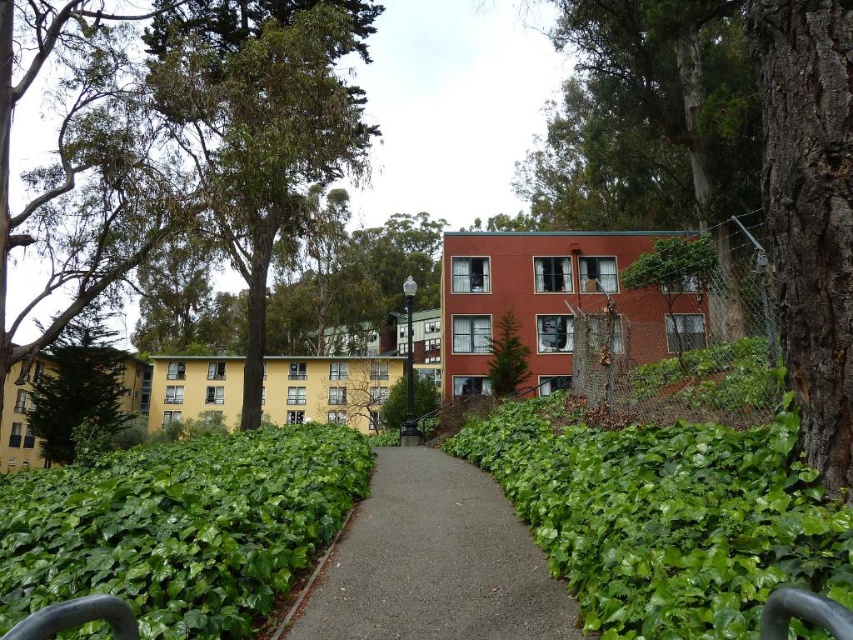
Based on the photo, which is below, green leafy hedge at center or green leafy tree at upper left?

Positioned lower is green leafy hedge at center.

Who is positioned more to the left, green leafy hedge at center or green leafy tree at upper left?

From the viewer's perspective, green leafy tree at upper left appears more on the left side.

Who is more forward, (689, 481) or (225, 234)?

Point (689, 481) is more forward.

Locate an element on the screen. The height and width of the screenshot is (640, 853). green leafy hedge at center is located at coordinates (665, 516).

Can you confirm if dark brown bark tree at right is taller than green leafy bush at center?

Incorrect, dark brown bark tree at right's height is not larger of green leafy bush at center's.

Does point (817, 196) lie in front of point (399, 388)?

That is True.

Which is in front, point (840, 429) or point (386, 404)?

Positioned in front is point (840, 429).

This screenshot has width=853, height=640. I want to click on dark brown bark tree at right, so click(810, 211).

Can you confirm if gray concrete path at center is positioned above green leafy bush at center?

Indeed, gray concrete path at center is positioned over green leafy bush at center.

Is point (376, 458) more distant than point (393, 396)?

No, (376, 458) is in front of (393, 396).

Locate an element on the screen. The height and width of the screenshot is (640, 853). gray concrete path at center is located at coordinates (434, 563).